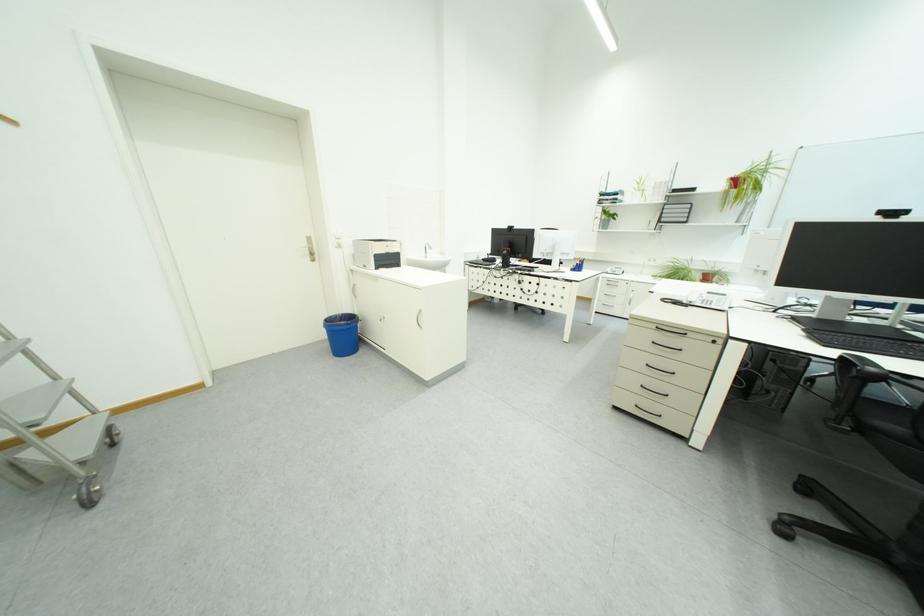
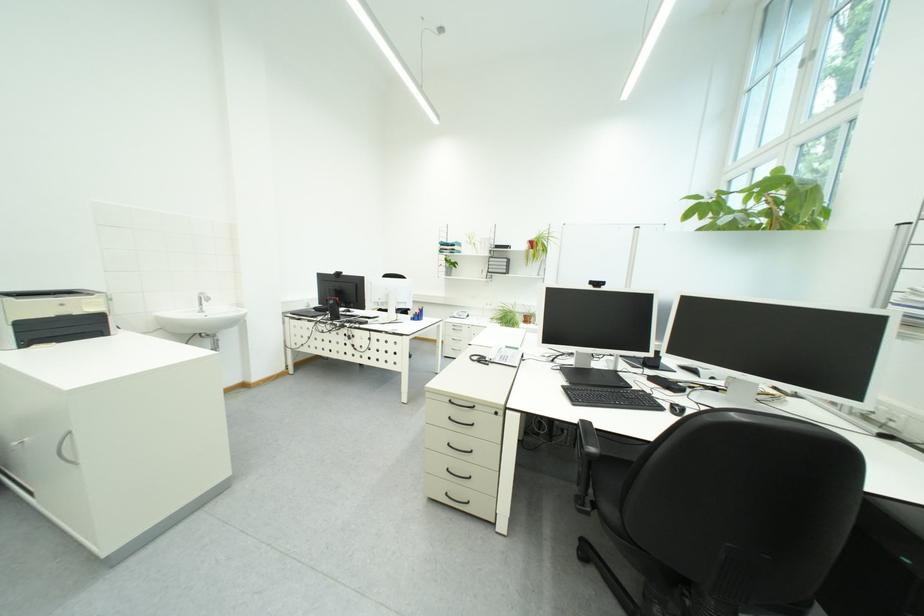
Find the pixel in the second image that matches [393,249] in the first image.

(55, 310)